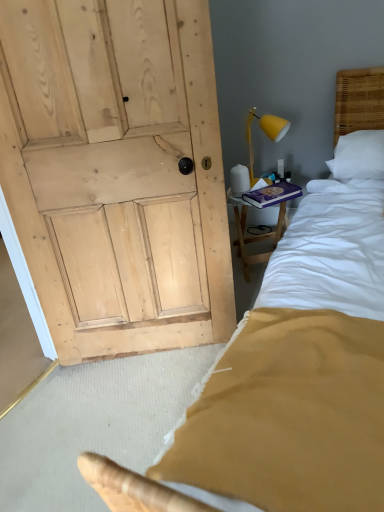
Question: Does wooden bedside table at right appear on the right side of yellow matte lamp at upper right?

Choices:
 (A) yes
 (B) no

Answer: (A)

Question: Can you confirm if wooden bedside table at right is smaller than yellow matte lamp at upper right?

Choices:
 (A) no
 (B) yes

Answer: (A)

Question: Is the position of wooden bedside table at right less distant than that of yellow matte lamp at upper right?

Choices:
 (A) no
 (B) yes

Answer: (A)

Question: Considering the relative sizes of wooden bedside table at right and yellow matte lamp at upper right in the image provided, is wooden bedside table at right taller than yellow matte lamp at upper right?

Choices:
 (A) yes
 (B) no

Answer: (A)

Question: Is wooden bedside table at right oriented away from yellow matte lamp at upper right?

Choices:
 (A) yes
 (B) no

Answer: (B)

Question: From the image's perspective, is purple hardcover book at upper right above or below wooden bedside table at right?

Choices:
 (A) below
 (B) above

Answer: (B)

Question: Relative to wooden bedside table at right, is purple hardcover book at upper right in front or behind?

Choices:
 (A) behind
 (B) front

Answer: (B)

Question: From a real-world perspective, relative to wooden bedside table at right, is purple hardcover book at upper right vertically above or below?

Choices:
 (A) above
 (B) below

Answer: (A)

Question: Choose the correct answer: Is purple hardcover book at upper right inside wooden bedside table at right or outside it?

Choices:
 (A) outside
 (B) inside

Answer: (A)

Question: Which is correct: wooden bedside table at right is inside yellow matte lamp at upper right, or outside of it?

Choices:
 (A) outside
 (B) inside

Answer: (A)

Question: Relative to yellow matte lamp at upper right, is wooden bedside table at right in front or behind?

Choices:
 (A) front
 (B) behind

Answer: (B)

Question: From a real-world perspective, is wooden bedside table at right physically located above or below yellow matte lamp at upper right?

Choices:
 (A) above
 (B) below

Answer: (B)

Question: From the image's perspective, relative to yellow matte lamp at upper right, is wooden bedside table at right above or below?

Choices:
 (A) below
 (B) above

Answer: (A)

Question: Is purple hardcover book at upper right to the left or to the right of yellow matte lamp at upper right in the image?

Choices:
 (A) left
 (B) right

Answer: (B)

Question: In terms of size, does purple hardcover book at upper right appear bigger or smaller than yellow matte lamp at upper right?

Choices:
 (A) small
 (B) big

Answer: (A)